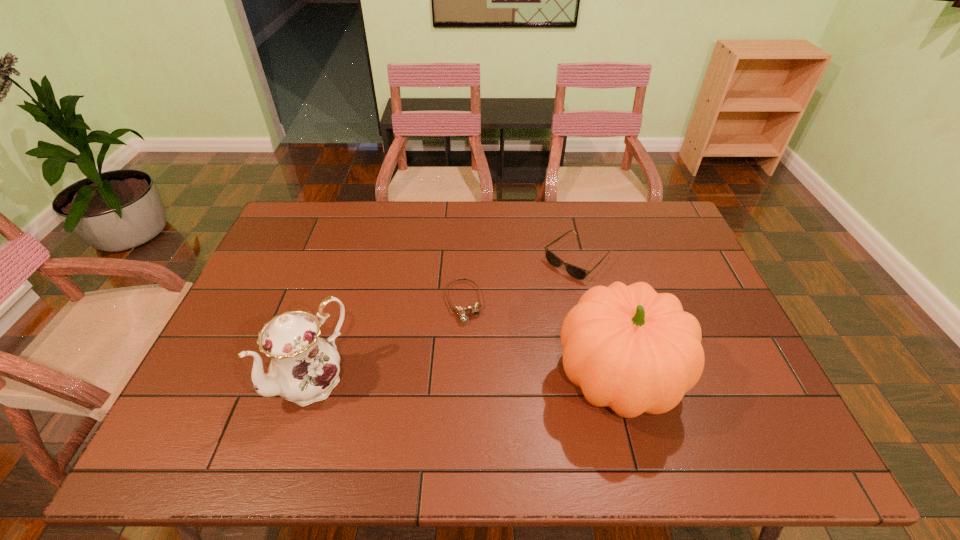
You are a GUI agent. You are given a task and a screenshot of the screen. Output one action in this format:
    pyautogui.click(x=<x>, y=<y>)
    Task: Click on the leftmost object
    
    Given the screenshot: What is the action you would take?
    304,368

This screenshot has width=960, height=540. I want to click on pumpkin, so click(632, 349).

This screenshot has height=540, width=960. I want to click on the shortest object, so click(x=474, y=309).

The image size is (960, 540). What are the coordinates of `the third object from right to left` in the screenshot? It's located at (474, 309).

Where is `the third tallest object`? the third tallest object is located at coordinates (575, 272).

Find the location of `free space located 0.090m on the left of the leftmost object`. free space located 0.090m on the left of the leftmost object is located at coordinates (240, 380).

Where is `free space located on the back of the pumpkin`? free space located on the back of the pumpkin is located at coordinates (599, 309).

You are a GUI agent. You are given a task and a screenshot of the screen. Output one action in this format:
    pyautogui.click(x=<x>, y=<y>)
    Task: Click on the vacant area situated 0.220m on the front lenses and sides of the second object from left to right
    The image size is (960, 540).
    Given the screenshot: What is the action you would take?
    pyautogui.click(x=487, y=394)

Image resolution: width=960 pixels, height=540 pixels. In order to click on vacant position located on the front lenses and sides of the second object from left to right in this screenshot , I will do `click(472, 342)`.

Find the location of a particular element. Image resolution: width=960 pixels, height=540 pixels. vacant region located 0.200m on the front lenses and sides of the second object from left to right is located at coordinates (485, 387).